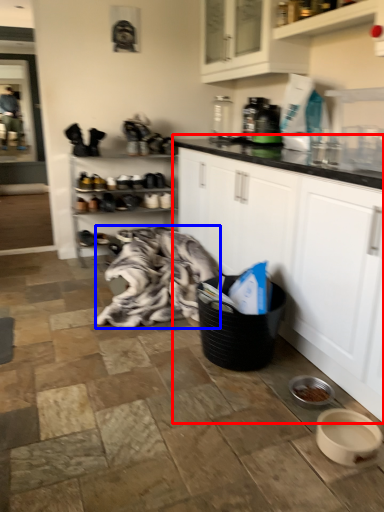
Question: Which of the following is the closest to the observer, cabinetry (highlighted by a red box) or blanket (highlighted by a blue box)?

Choices:
 (A) cabinetry
 (B) blanket

Answer: (A)